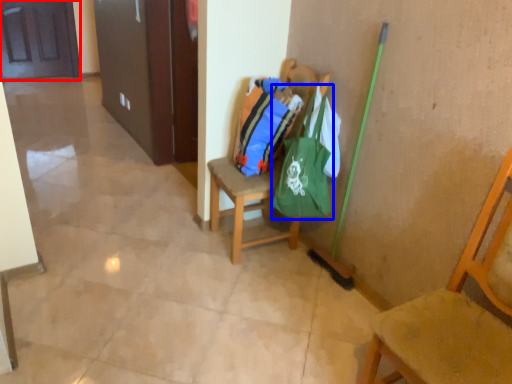
Question: Which point is further to the camera, door (highlighted by a red box) or shoulder bag (highlighted by a blue box)?

Choices:
 (A) door
 (B) shoulder bag

Answer: (A)